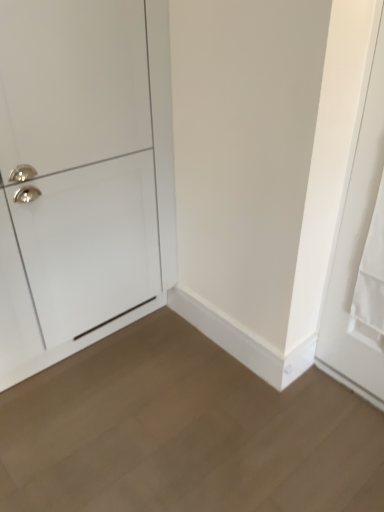
Question: Does light brown wood floor at lower center appear on the left side of white glossy cabinet at left, the first door from the left?

Choices:
 (A) no
 (B) yes

Answer: (A)

Question: From a real-world perspective, is light brown wood floor at lower center physically below white glossy cabinet at left, the second door in the right-to-left sequence?

Choices:
 (A) no
 (B) yes

Answer: (B)

Question: Does light brown wood floor at lower center lie in front of white glossy cabinet at left, the second door in the right-to-left sequence?

Choices:
 (A) yes
 (B) no

Answer: (A)

Question: Is light brown wood floor at lower center at the right side of white glossy cabinet at left, the first door from the left?

Choices:
 (A) no
 (B) yes

Answer: (B)

Question: Is light brown wood floor at lower center turned away from white glossy cabinet at left, the first door from the left?

Choices:
 (A) yes
 (B) no

Answer: (B)

Question: Visually, is white glossy cabinet at left, the first door from the left, positioned to the left or to the right of white matte door at right, the first door when ordered from right to left?

Choices:
 (A) right
 (B) left

Answer: (B)

Question: Considering the positions of point (137, 261) and point (382, 36), is point (137, 261) closer or farther from the camera than point (382, 36)?

Choices:
 (A) farther
 (B) closer

Answer: (A)

Question: From their relative heights in the image, would you say white glossy cabinet at left, the second door in the right-to-left sequence, is taller or shorter than white matte door at right, the first door when ordered from right to left?

Choices:
 (A) short
 (B) tall

Answer: (B)

Question: Is white glossy cabinet at left, the first door from the left, situated inside white matte door at right, the first door when ordered from right to left, or outside?

Choices:
 (A) outside
 (B) inside

Answer: (A)

Question: Is white matte door at right, the second door positioned from the left, taller or shorter than white glossy cabinet at left, the first door from the left?

Choices:
 (A) short
 (B) tall

Answer: (A)

Question: Considering their positions, is white matte door at right, the second door positioned from the left, located in front of or behind white glossy cabinet at left, the first door from the left?

Choices:
 (A) behind
 (B) front

Answer: (B)

Question: Choose the correct answer: Is white matte door at right, the first door when ordered from right to left, inside white glossy cabinet at left, the first door from the left, or outside it?

Choices:
 (A) inside
 (B) outside

Answer: (B)

Question: Based on their sizes in the image, would you say white matte door at right, the second door positioned from the left, is bigger or smaller than white glossy cabinet at left, the first door from the left?

Choices:
 (A) big
 (B) small

Answer: (B)

Question: Considering the positions of white matte door at right, the first door when ordered from right to left, and light brown wood floor at lower center in the image, is white matte door at right, the first door when ordered from right to left, wider or thinner than light brown wood floor at lower center?

Choices:
 (A) thin
 (B) wide

Answer: (A)

Question: Does point (352, 308) appear closer or farther from the camera than point (84, 475)?

Choices:
 (A) farther
 (B) closer

Answer: (A)